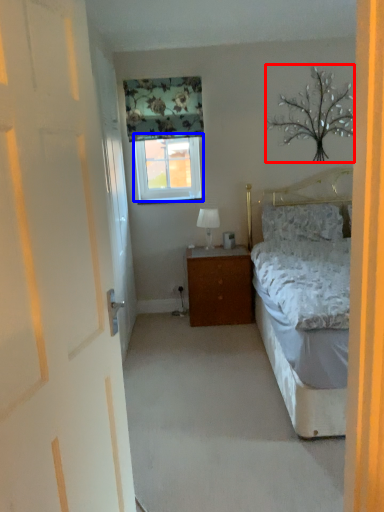
Question: Which of the following is the farthest to the observer, tree (highlighted by a red box) or window (highlighted by a blue box)?

Choices:
 (A) tree
 (B) window

Answer: (B)